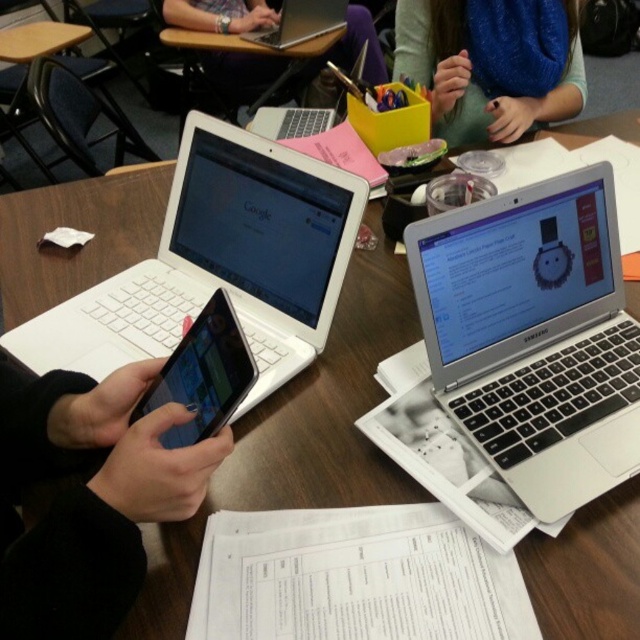
You are standing in the classroom and want to reach both points on the table. Which point, point (234, 324) or point (337, 28), is closer to you?

Point (234, 324) is closer to the viewer than point (337, 28).

You are a student who needs to take a photo of the blue knitted sweater at upper center for a project. The camera is 1.07 meters away from it. Is the distance sufficient for a clear photo?

The blue knitted sweater at upper center and camera are 1.07 meters apart from each other, so the distance is sufficient for a clear photo as most cameras can focus at that distance.